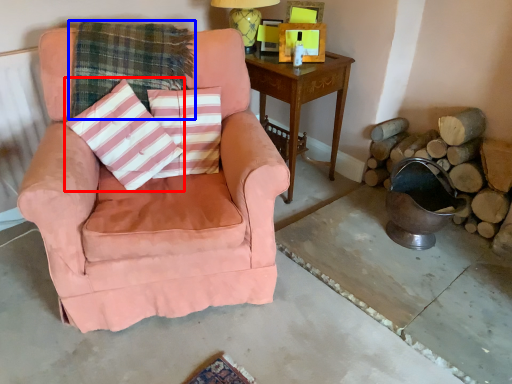
Question: Which of the following is the closest to the observer, throw pillow (highlighted by a red box) or plaid (highlighted by a blue box)?

Choices:
 (A) throw pillow
 (B) plaid

Answer: (A)